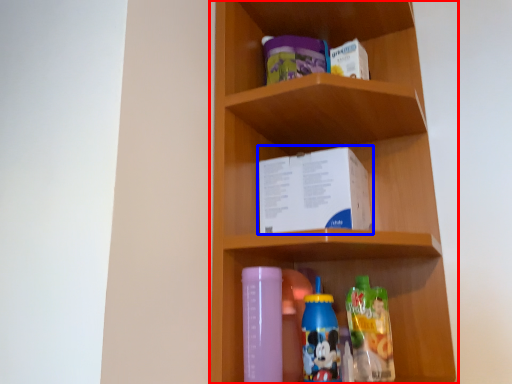
Question: Which of the following is the closest to the observer, shelf (highlighted by a red box) or book (highlighted by a blue box)?

Choices:
 (A) shelf
 (B) book

Answer: (A)